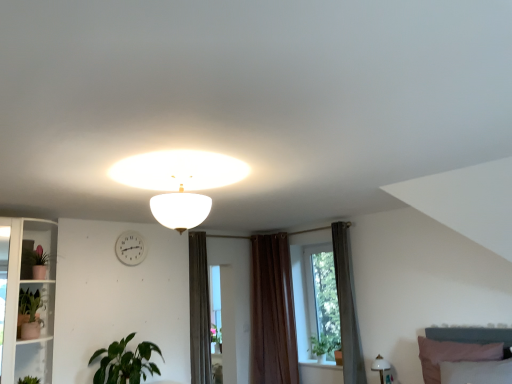
Question: Would you say green leafy plant at window, which is the second plant in front-to-back order, is to the left or to the right of brown velvet curtain at center, the 2th curtain from the right, in the picture?

Choices:
 (A) right
 (B) left

Answer: (A)

Question: Which is correct: green leafy plant at window, which is the second plant in front-to-back order, is inside brown velvet curtain at center, the 2th curtain from the right, or outside of it?

Choices:
 (A) inside
 (B) outside

Answer: (B)

Question: Based on their relative distances, which object is farther from the white matte lampshade at center, the second lamp positioned from the right?

Choices:
 (A) brown velvet curtain at center, the 2th curtain from the right
 (B) transparent glass window at center
 (C) green leafy plant at window, which is the 2th plant in top-to-bottom order
 (D) green matte plant at lower left, positioned as the 1th houseplant in bottom-to-top order
 (E) matte pink pot at left, acting as the 1th plant starting from the left

Answer: (C)

Question: Which of these objects is positioned farthest from the green matte plant at lower left, the 1th houseplant in the right-to-left sequence?

Choices:
 (A) brown fabric curtain at center, the first curtain from the front
 (B) transparent glass window at center
 (C) brown velvet curtain at center, which is the second curtain in front-to-back order
 (D) green leafy plant at window, marked as the 1th plant in a back-to-front arrangement
 (E) white matte lampshade at center, the first lamp viewed from the front

Answer: (D)